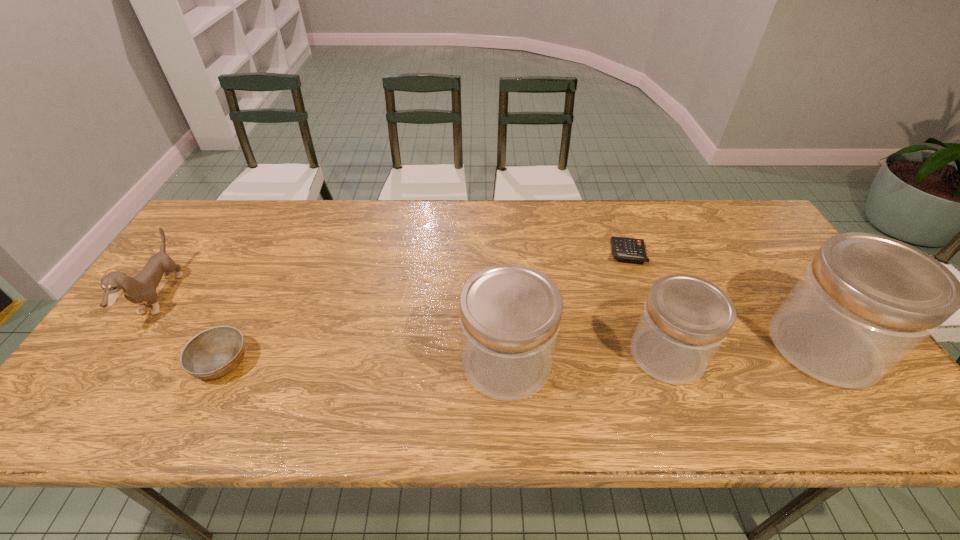
Where is `vacant space that satisfies the following two spatial constraints: 1. on the front side of the second jar from left to right; 2. on the right side of the shortest object`? vacant space that satisfies the following two spatial constraints: 1. on the front side of the second jar from left to right; 2. on the right side of the shortest object is located at coordinates (664, 354).

In order to click on vacant region that satisfies the following two spatial constraints: 1. on the back side of the second jar from left to right; 2. on the left side of the bowl in this screenshot , I will do `click(225, 354)`.

Where is `free space that satisfies the following two spatial constraints: 1. at the face of the puppy; 2. on the back side of the rightmost jar`? The image size is (960, 540). free space that satisfies the following two spatial constraints: 1. at the face of the puppy; 2. on the back side of the rightmost jar is located at coordinates (126, 346).

I want to click on free space in the image that satisfies the following two spatial constraints: 1. at the face of the puppy; 2. on the left side of the second shortest object, so tap(114, 362).